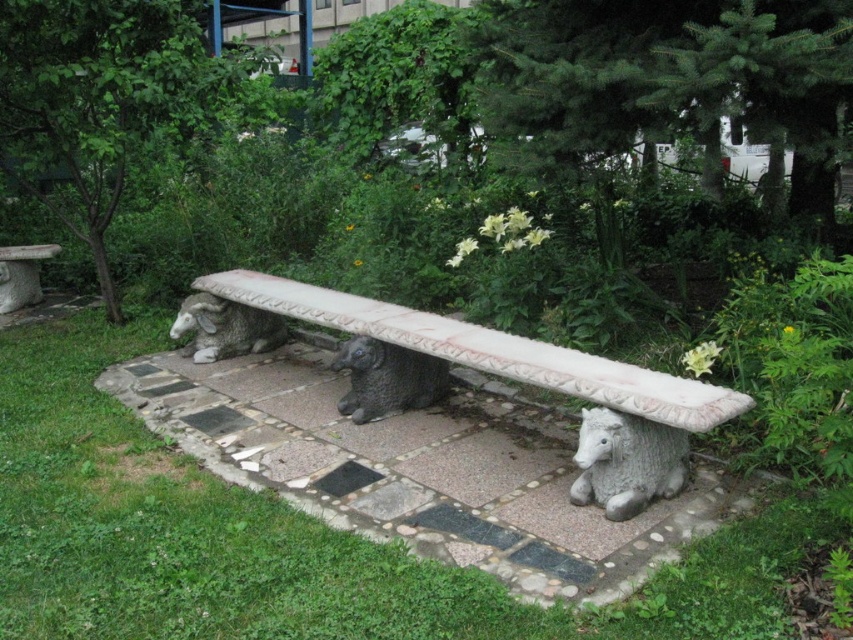
Question: Estimate the real-world distances between objects in this image. Which object is closer to the white stone bench at center?

Choices:
 (A) gray stone bench at left
 (B) gray stone sheep at left

Answer: (B)

Question: Does gray stone sheep at lower right have a greater width compared to gray stone sheep at left?

Choices:
 (A) no
 (B) yes

Answer: (A)

Question: Which object appears closest to the camera in this image?

Choices:
 (A) gray stone sheep at center
 (B) gray stone bench at left

Answer: (A)

Question: Is gray stone sheep at center above gray stone sheep at left?

Choices:
 (A) yes
 (B) no

Answer: (B)

Question: Can you confirm if white stone bench at center is thinner than gray stone bench at left?

Choices:
 (A) yes
 (B) no

Answer: (B)

Question: Which of the following is the closest to the observer?

Choices:
 (A) gray stone sheep at left
 (B) gray stone bench at left

Answer: (A)